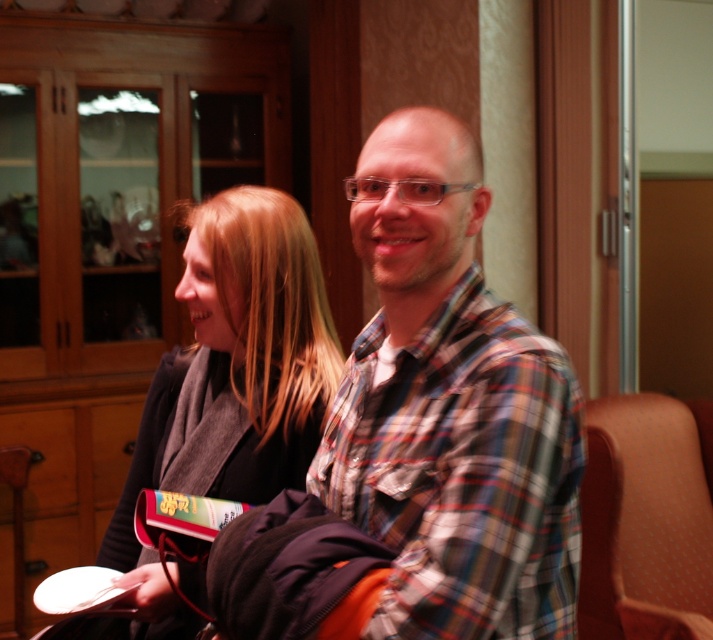
Does plaid shirt at center have a lesser height compared to matte black jacket at center?

Correct, plaid shirt at center is not as tall as matte black jacket at center.

Image resolution: width=713 pixels, height=640 pixels. What do you see at coordinates (451, 408) in the screenshot?
I see `plaid shirt at center` at bounding box center [451, 408].

Image resolution: width=713 pixels, height=640 pixels. What do you see at coordinates (451, 408) in the screenshot?
I see `plaid shirt at center` at bounding box center [451, 408].

You are a GUI agent. You are given a task and a screenshot of the screen. Output one action in this format:
    pyautogui.click(x=<x>, y=<y>)
    Task: Click on the plaid shirt at center
    This screenshot has height=640, width=713.
    Given the screenshot: What is the action you would take?
    pyautogui.click(x=451, y=408)

Measure the distance from matte black jacket at center to orange fabric chair at right.

→ They are 1.11 meters apart.

Is the position of matte black jacket at center more distant than that of orange fabric chair at right?

That is False.

The image size is (713, 640). Describe the element at coordinates (230, 387) in the screenshot. I see `matte black jacket at center` at that location.

Locate an element on the screen. The height and width of the screenshot is (640, 713). matte black jacket at center is located at coordinates (230, 387).

Between plaid shirt at center and orange fabric chair at right, which one has more height?

Standing taller between the two is plaid shirt at center.

Is plaid shirt at center positioned at the back of orange fabric chair at right?

No, plaid shirt at center is closer to the viewer.

Is point (548, 531) more distant than point (697, 506)?

No.

Image resolution: width=713 pixels, height=640 pixels. I want to click on plaid shirt at center, so click(x=451, y=408).